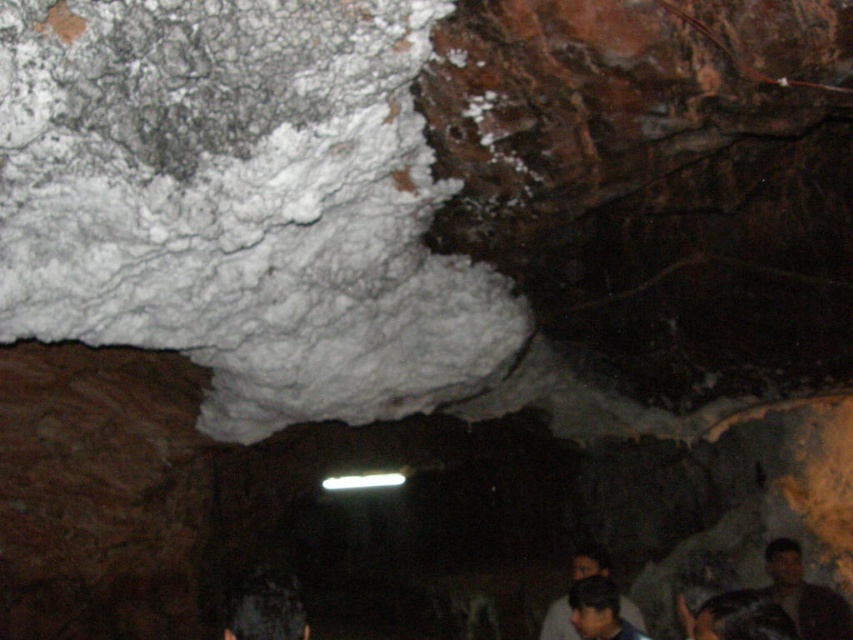
You are a cave explorer holding a flashlight. You notice the white crumbly rock at upper left and the dark brown hair at lower right in your line of sight. Which object is closer to you?

The white crumbly rock at upper left is closer to you because it is in front of the dark brown hair at lower right.

You are a spelunker exploring the cave and notice two items at the lower right corner of your view. The items are the dark brown leather jacket at lower right and the dark hair at lower right. Which item takes up more space in your field of view?

The dark brown leather jacket at lower right has a larger size compared to the dark hair at lower right, so it takes up more space in your field of view.